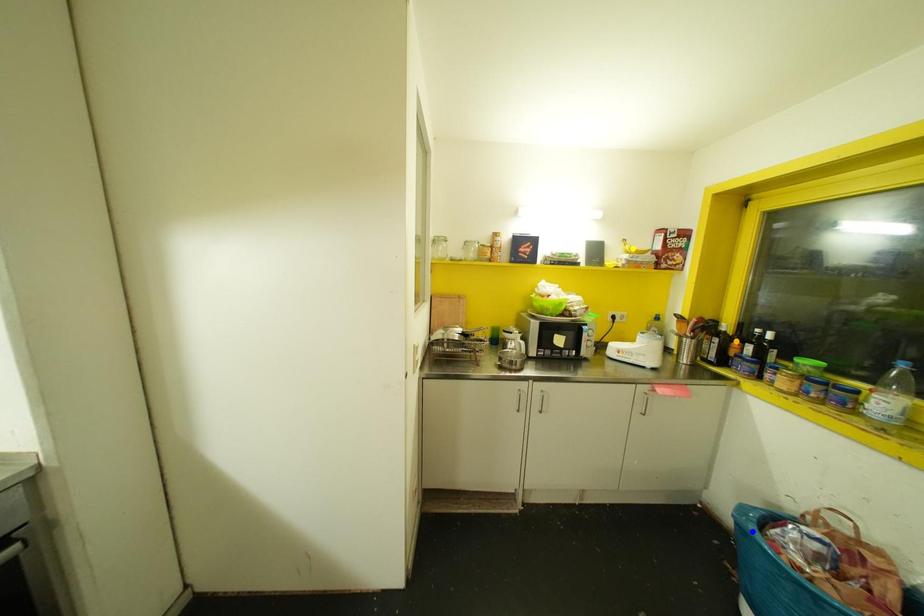
Order these from nearest to farthest:
orange point
blue point
yellow point

blue point → orange point → yellow point